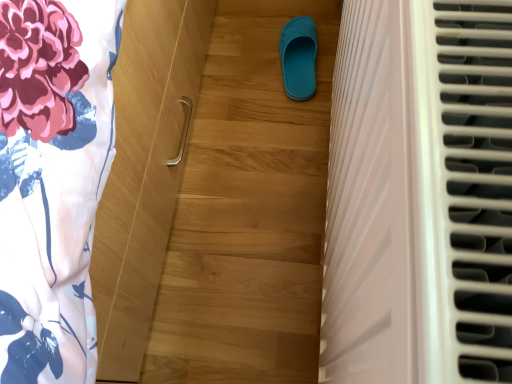
Question: Can you confirm if teal rubber slipper at center is taller than white plastic radiator at right?

Choices:
 (A) yes
 (B) no

Answer: (B)

Question: Can you confirm if teal rubber slipper at center is shorter than white plastic radiator at right?

Choices:
 (A) no
 (B) yes

Answer: (B)

Question: Does teal rubber slipper at center have a lesser width compared to white plastic radiator at right?

Choices:
 (A) no
 (B) yes

Answer: (B)

Question: Is the depth of teal rubber slipper at center greater than that of white plastic radiator at right?

Choices:
 (A) yes
 (B) no

Answer: (A)

Question: From the image's perspective, is teal rubber slipper at center under white plastic radiator at right?

Choices:
 (A) no
 (B) yes

Answer: (A)

Question: From the image's perspective, is teal rubber slipper at center above white plastic radiator at right?

Choices:
 (A) no
 (B) yes

Answer: (B)

Question: Is white plastic radiator at right in front of teal rubber slipper at center?

Choices:
 (A) no
 (B) yes

Answer: (B)

Question: Is teal rubber slipper at center at the back of white plastic radiator at right?

Choices:
 (A) no
 (B) yes

Answer: (A)

Question: From the image's perspective, is white plastic radiator at right on top of teal rubber slipper at center?

Choices:
 (A) yes
 (B) no

Answer: (B)

Question: Considering the relative sizes of white plastic radiator at right and teal rubber slipper at center in the image provided, is white plastic radiator at right thinner than teal rubber slipper at center?

Choices:
 (A) yes
 (B) no

Answer: (B)

Question: From a real-world perspective, is white plastic radiator at right located beneath teal rubber slipper at center?

Choices:
 (A) yes
 (B) no

Answer: (B)

Question: Can you confirm if white plastic radiator at right is positioned to the right of teal rubber slipper at center?

Choices:
 (A) yes
 (B) no

Answer: (A)

Question: From a real-world perspective, relative to white plastic radiator at right, is teal rubber slipper at center vertically above or below?

Choices:
 (A) below
 (B) above

Answer: (A)